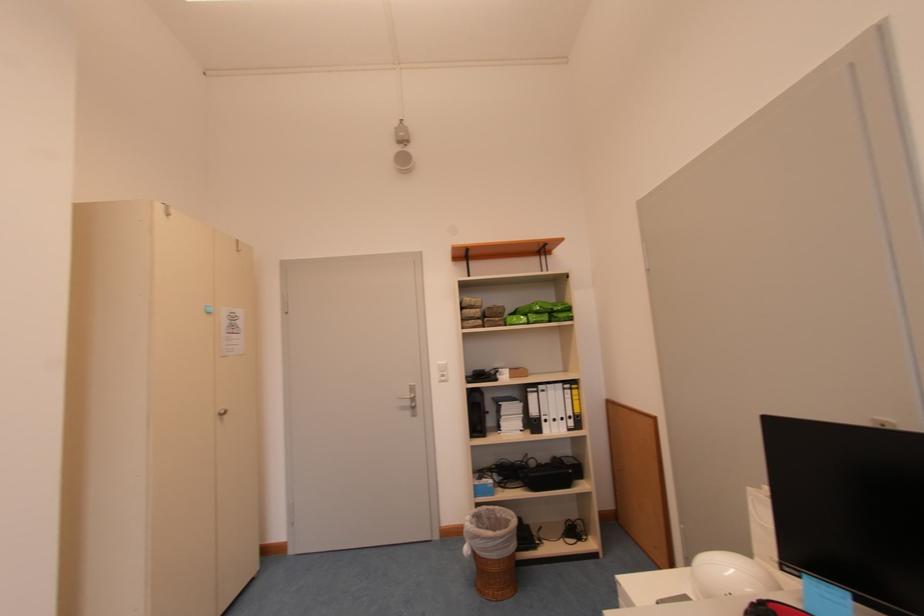
Find where to turn the cabinet door knob. Please return your answer as a coordinate pair (x, y).

(222, 411)